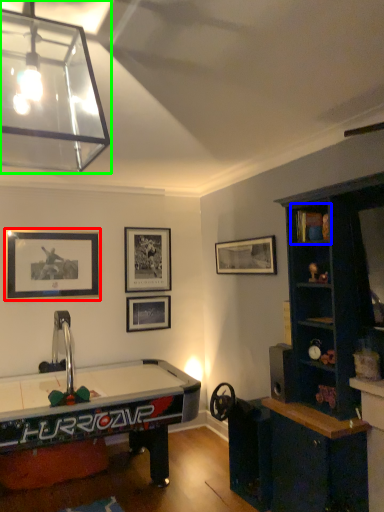
Question: Which is farther away from picture frame (highlighted by a red box)? cabinet (highlighted by a blue box) or lamp (highlighted by a green box)?

Choices:
 (A) cabinet
 (B) lamp

Answer: (A)